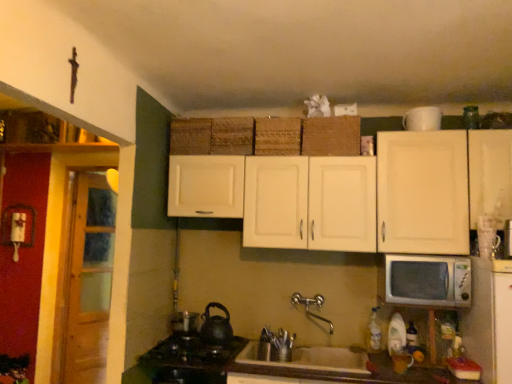
Question: In terms of size, does wooden at left appear bigger or smaller than brown woven basket at upper center, which is counted as the first basket, starting from the right?

Choices:
 (A) small
 (B) big

Answer: (B)

Question: From a real-world perspective, relative to brown woven basket at upper center, which ranks as the 4th basket in left-to-right order, is wooden at left vertically above or below?

Choices:
 (A) above
 (B) below

Answer: (B)

Question: Estimate the real-world distances between objects in this image. Which object is closer to the wooden at left?

Choices:
 (A) woven straw basket at center, which is the 3th basket from left to right
 (B) woven brown basket at center, the 3th basket when ordered from right to left
 (C) white porcelain sink at center
 (D) satin nickel faucet at sink center
 (E) white matte cabinet at upper center

Answer: (B)

Question: Estimate the real-world distances between objects in this image. Which object is closer to the woven brown basket at center, acting as the second basket starting from the left?

Choices:
 (A) white matte mug at upper right
 (B) white matte cabinet at upper center
 (C) satin nickel faucet at sink center
 (D) black matte tea pot at lower center
 (E) woven brown basket at upper center, which is counted as the first basket, starting from the left

Answer: (E)